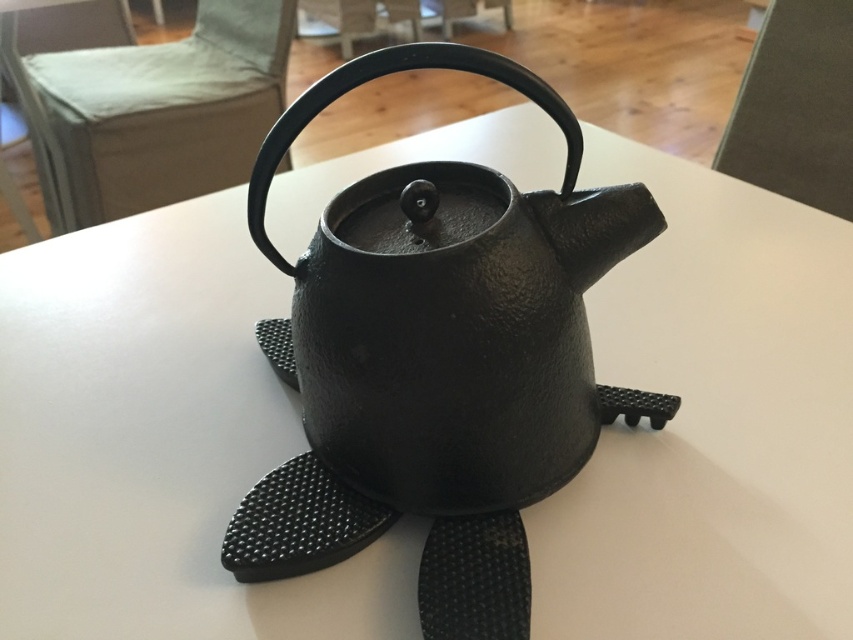
Does matte black teapot at center appear on the right side of black cast iron teapot at center?

Yes, matte black teapot at center is to the right of black cast iron teapot at center.

Who is positioned more to the right, matte black teapot at center or black cast iron teapot at center?

matte black teapot at center is more to the right.

Which is in front, point (544, 435) or point (409, 202)?

Positioned in front is point (409, 202).

I want to click on matte black teapot at center, so click(451, 310).